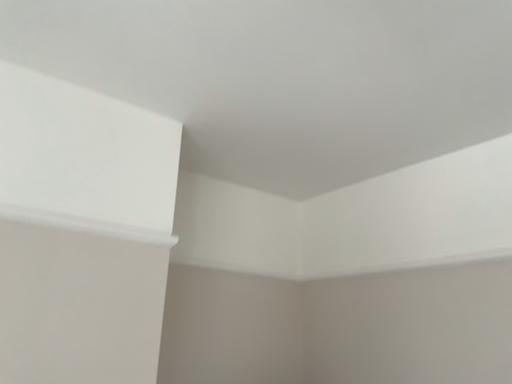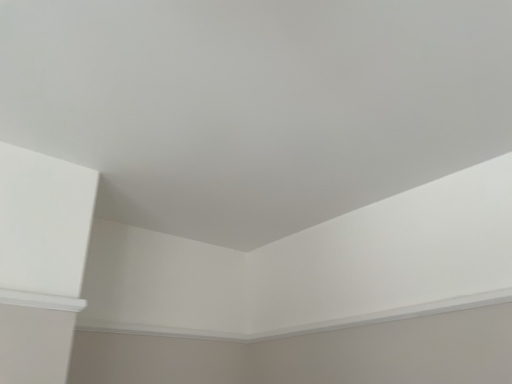
Question: Which way did the camera rotate in the video?

Choices:
 (A) rotated downward
 (B) rotated upward

Answer: (B)